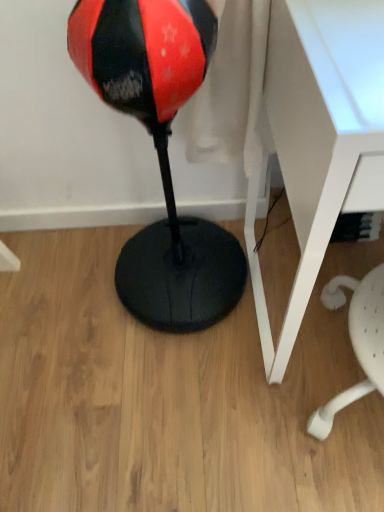
Question: Considering the positions of red/black glossy bean bag at center and white plastic table at right in the image, is red/black glossy bean bag at center taller or shorter than white plastic table at right?

Choices:
 (A) short
 (B) tall

Answer: (B)

Question: From the image's perspective, is red/black glossy bean bag at center above or below white plastic table at right?

Choices:
 (A) below
 (B) above

Answer: (B)

Question: Is point (142, 306) closer or farther from the camera than point (289, 330)?

Choices:
 (A) farther
 (B) closer

Answer: (A)

Question: Considering the positions of white plastic table at right and red/black glossy bean bag at center in the image, is white plastic table at right wider or thinner than red/black glossy bean bag at center?

Choices:
 (A) wide
 (B) thin

Answer: (A)

Question: Looking at the image, does white plastic table at right seem bigger or smaller compared to red/black glossy bean bag at center?

Choices:
 (A) big
 (B) small

Answer: (A)

Question: From a real-world perspective, is white plastic table at right positioned above or below red/black glossy bean bag at center?

Choices:
 (A) above
 (B) below

Answer: (B)

Question: From the image's perspective, is white plastic table at right above or below red/black glossy bean bag at center?

Choices:
 (A) below
 (B) above

Answer: (A)